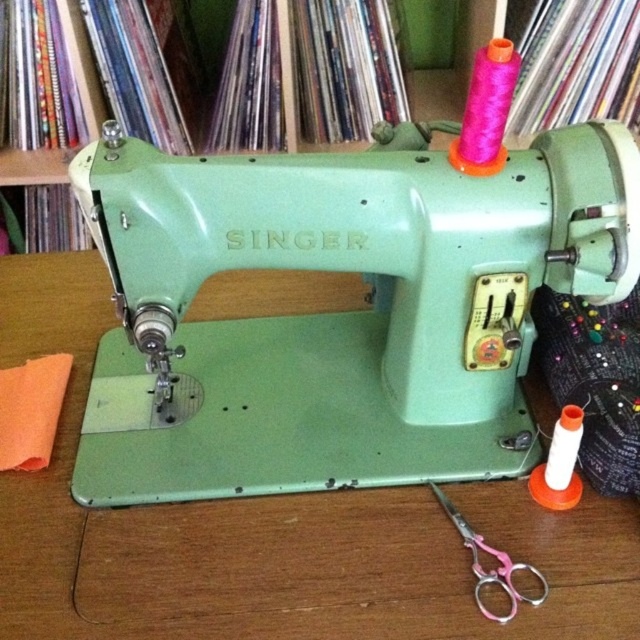
Question: Does green matte sewing machine at center lie in front of pink plastic scissors at lower right?

Choices:
 (A) yes
 (B) no

Answer: (A)

Question: Which is nearer to the matte green sewing machine at center?

Choices:
 (A) pink plastic scissors at lower right
 (B) green matte sewing machine at center

Answer: (B)

Question: Which point appears closest to the camera in this image?

Choices:
 (A) (67, 392)
 (B) (484, 572)

Answer: (B)

Question: Which is nearer to the green matte sewing machine at center?

Choices:
 (A) matte green sewing machine at center
 (B) pink plastic scissors at lower right

Answer: (A)

Question: Is green matte sewing machine at center to the left of pink plastic scissors at lower right from the viewer's perspective?

Choices:
 (A) yes
 (B) no

Answer: (A)

Question: Is matte green sewing machine at center to the left of pink plastic scissors at lower right from the viewer's perspective?

Choices:
 (A) no
 (B) yes

Answer: (B)